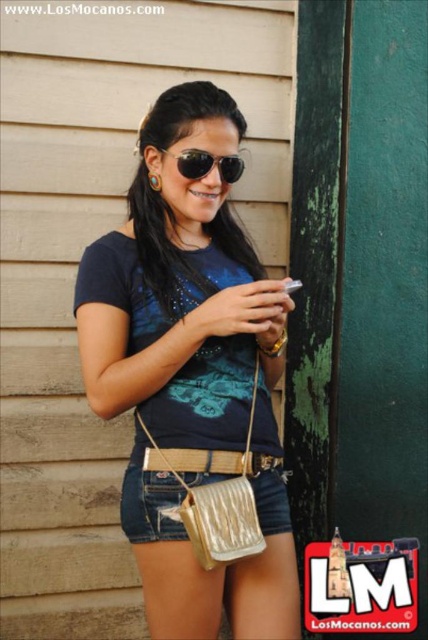
You are a photographer setting up a shoot. You need to ensure that the metallic gold purse at lower center and the sunglasses at center are both visible in the frame. Given their sizes, which object should be placed closer to the camera to maintain their visibility without overlapping?

The metallic gold purse at lower center is larger in size than sunglasses at center, so to maintain visibility without overlapping, the sunglasses at center should be placed closer to the camera since smaller objects need to be nearer to appear similarly sized in the frame.

You are a photographer standing 1.5 meters away from the wooden wall. You want to take a closeup shot of the metallic gold purse at center without moving closer than 1.1 meters. Is it possible?

The metallic gold purse at center is 1.17 meters away from the viewer. Since 1.17 meters is greater than 1.1 meters, you can take the closeup shot without moving closer than 1.1 meters.